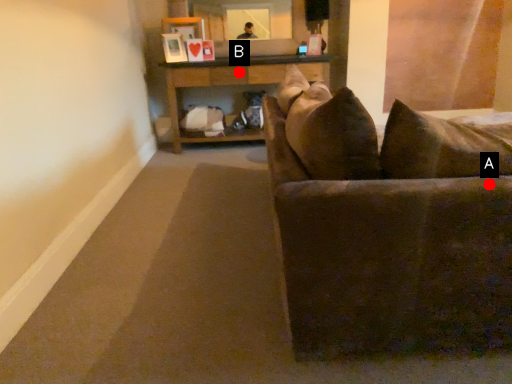
Question: Two points are circled on the image, labeled by A and B beside each circle. Which of the following is the farthest from the observer?

Choices:
 (A) A is further
 (B) B is further

Answer: (B)